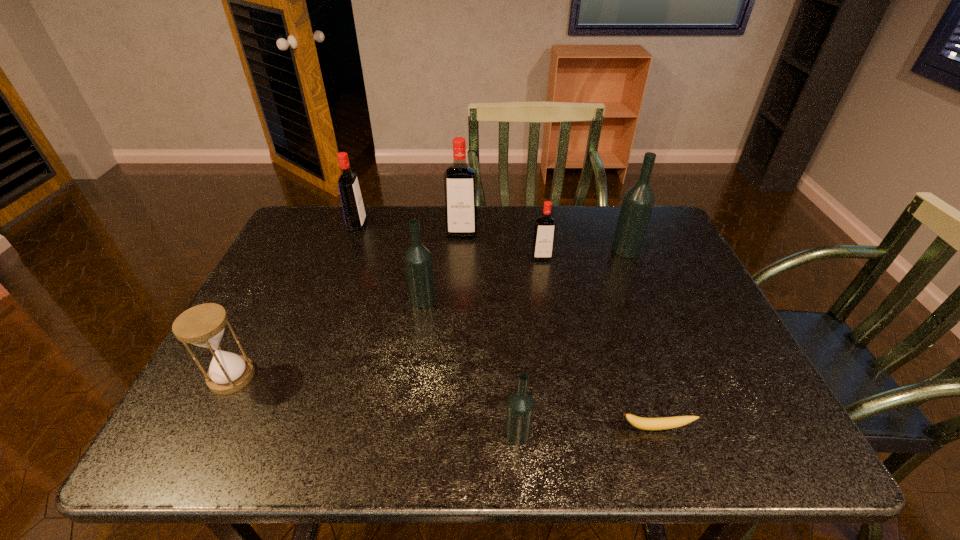
Locate an element on the screen. The width and height of the screenshot is (960, 540). vacant region at the right edge is located at coordinates (687, 341).

Locate an element on the screen. free space at the far right corner is located at coordinates (614, 222).

The height and width of the screenshot is (540, 960). Find the location of `unoccupied area between the smallest red vodka and the smallest black vodka`. unoccupied area between the smallest red vodka and the smallest black vodka is located at coordinates (530, 345).

Locate an element on the screen. This screenshot has width=960, height=540. vacant area that lies between the hourglass and the rightmost black vodka is located at coordinates (429, 313).

Image resolution: width=960 pixels, height=540 pixels. I want to click on free space between the fifth object from left to right and the rightmost vodka, so click(572, 342).

The height and width of the screenshot is (540, 960). Find the location of `vacant space that's between the second red vodka from right to left and the hourglass`. vacant space that's between the second red vodka from right to left and the hourglass is located at coordinates (347, 304).

Where is `vacant point located between the leftmost object and the leftmost red vodka`? Image resolution: width=960 pixels, height=540 pixels. vacant point located between the leftmost object and the leftmost red vodka is located at coordinates (295, 301).

This screenshot has width=960, height=540. What are the coordinates of `vacant point located between the second red vodka from right to left and the yellow banana` in the screenshot? It's located at (559, 330).

This screenshot has height=540, width=960. What are the coordinates of `unoccupied area between the banana and the second nearest black vodka` in the screenshot? It's located at (540, 364).

Find the location of a particular element. This screenshot has height=540, width=960. free space that is in between the second vodka from right to left and the rightmost vodka is located at coordinates (584, 253).